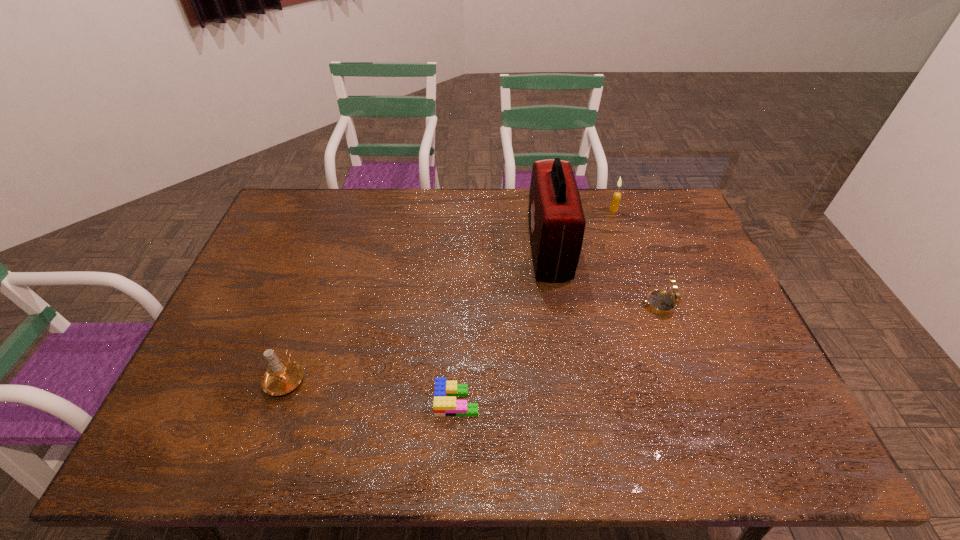
I want to click on candle at the far edge, so click(x=617, y=196).

At what (x,y) coordinates should I click in order to perform the action: click on object positioned at the right edge. Please return your answer as a coordinate pair (x, y). This screenshot has height=540, width=960. Looking at the image, I should click on (660, 302).

Identify the location of free space at the far edge of the desktop. (419, 198).

Locate an element on the screen. The height and width of the screenshot is (540, 960). blank space at the near edge is located at coordinates (548, 450).

Where is `blank space at the right edge of the desktop`? blank space at the right edge of the desktop is located at coordinates (663, 248).

The height and width of the screenshot is (540, 960). Identify the location of free space at the far left corner. (322, 204).

You are a GUI agent. You are given a task and a screenshot of the screen. Output one action in this format:
    pyautogui.click(x=<x>, y=<y>)
    Task: Click on the free region at the near left corner of the desktop
    
    Given the screenshot: What is the action you would take?
    pyautogui.click(x=206, y=447)

Image resolution: width=960 pixels, height=540 pixels. In order to click on free space between the compass and the first aid kit in this screenshot , I will do `click(603, 277)`.

Where is `free space that is in between the leftmost object and the tallest object`? free space that is in between the leftmost object and the tallest object is located at coordinates (418, 313).

At what (x,y) coordinates should I click in order to perform the action: click on vacant space that is in between the farthest object and the Lego. Please return your answer as a coordinate pair (x, y). Looking at the image, I should click on (536, 306).